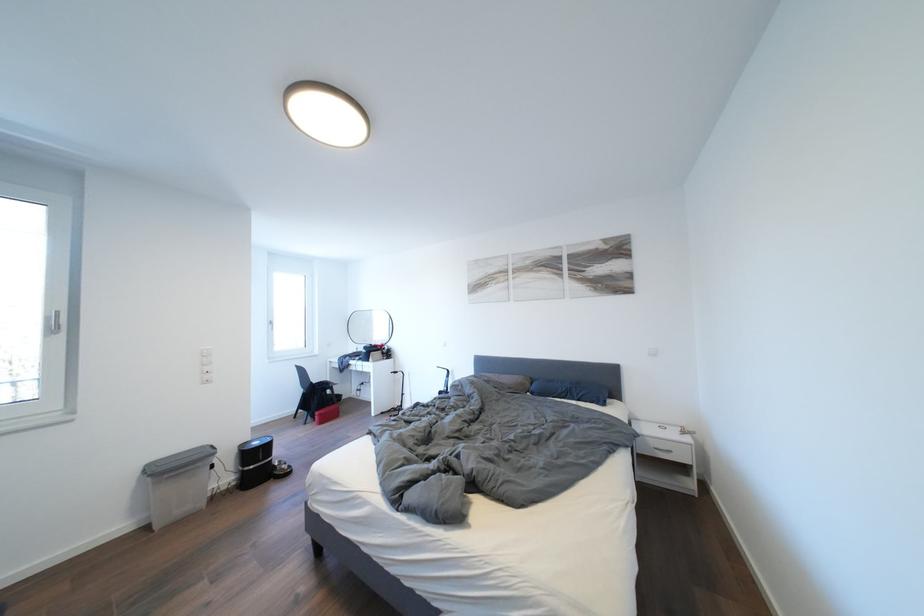
What do you see at coordinates (55, 323) in the screenshot? I see `the white window handle` at bounding box center [55, 323].